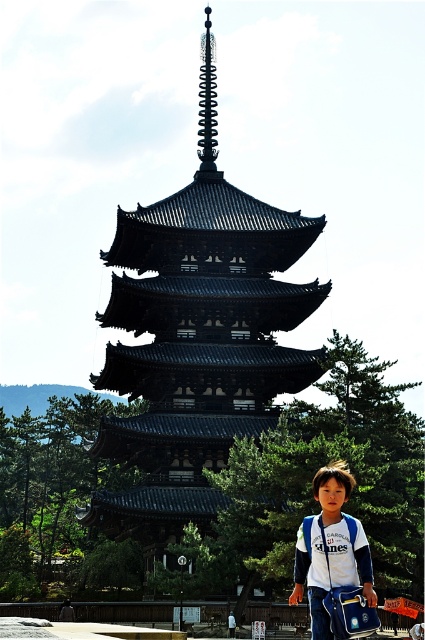
Question: Where is black wooden pagoda at center located in relation to white fabric backpack at lower center in the image?

Choices:
 (A) left
 (B) right

Answer: (A)

Question: Is black wooden pagoda at center in front of white fabric backpack at lower center?

Choices:
 (A) no
 (B) yes

Answer: (A)

Question: Is black wooden pagoda at center wider than white fabric backpack at lower center?

Choices:
 (A) yes
 (B) no

Answer: (A)

Question: Which object appears closest to the camera in this image?

Choices:
 (A) white fabric backpack at lower center
 (B) black wooden pagoda at center

Answer: (A)